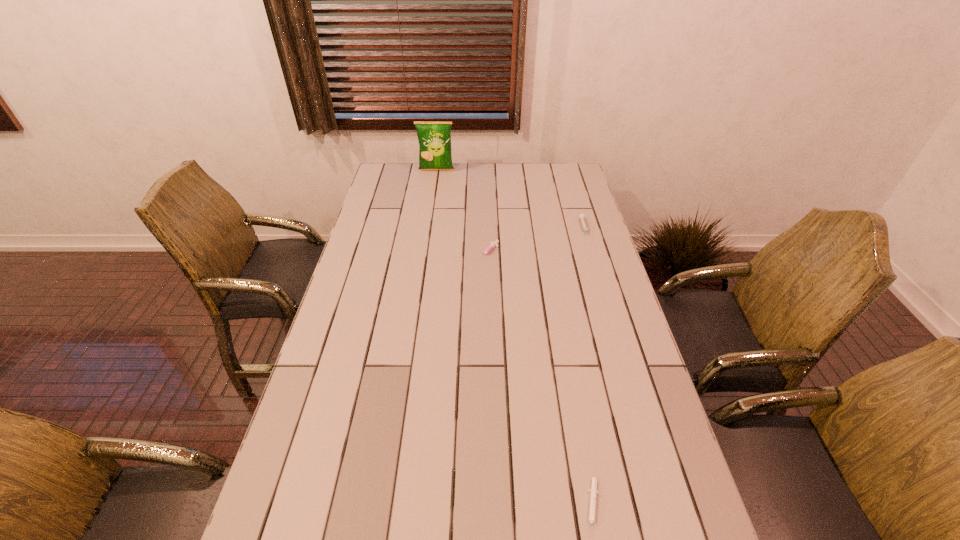
This screenshot has width=960, height=540. I want to click on object that is at the right edge, so click(581, 216).

In the image, there is a desktop. At what (x,y) coordinates should I click in order to perform the action: click on vacant space at the far edge. Please return your answer as a coordinate pair (x, y). This screenshot has height=540, width=960. Looking at the image, I should click on (429, 185).

This screenshot has width=960, height=540. I want to click on free space at the left edge, so click(x=354, y=435).

Identify the location of vacant region at the right edge of the desktop. click(x=612, y=275).

Image resolution: width=960 pixels, height=540 pixels. I want to click on free point at the far right corner, so click(543, 166).

Locate an element on the screen. free area in between the leftmost syringe and the tallest object is located at coordinates (463, 211).

What are the coordinates of `free space between the third nearest object and the third farthest object` in the screenshot? It's located at (537, 241).

Identify the location of free spot between the second farthest syringe and the farthest syringe. The height and width of the screenshot is (540, 960). 537,241.

What are the coordinates of `vacant area that lies between the second object from left to right and the crisp (potato chip)` in the screenshot? It's located at (463, 211).

Image resolution: width=960 pixels, height=540 pixels. In order to click on vacant space in between the leftmost object and the third nearest object in this screenshot , I will do `click(511, 199)`.